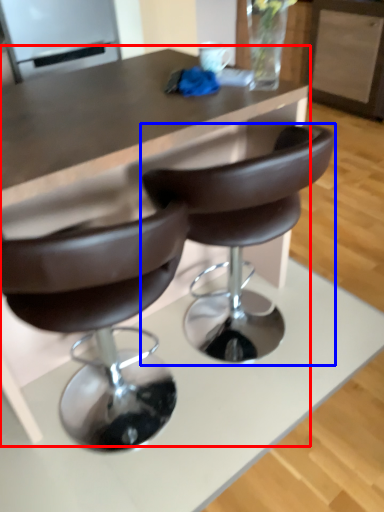
Question: Among these objects, which one is nearest to the camera, table (highlighted by a red box) or chair (highlighted by a blue box)?

Choices:
 (A) table
 (B) chair

Answer: (A)